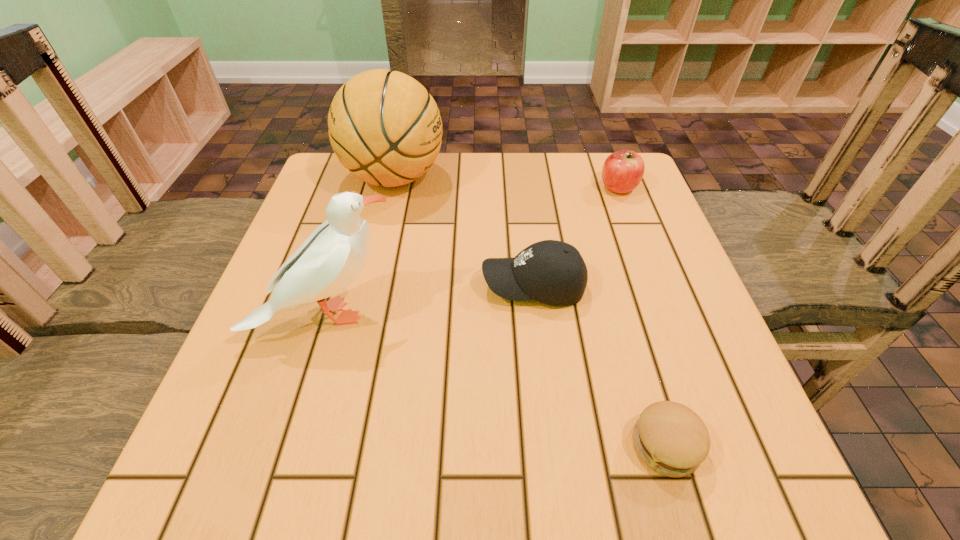
Identify the location of object at the far left corner. The width and height of the screenshot is (960, 540). (384, 126).

I want to click on object present at the far right corner, so click(x=623, y=170).

The height and width of the screenshot is (540, 960). I want to click on object situated at the near right corner, so click(x=670, y=438).

I want to click on vacant space at the far edge of the desktop, so click(408, 193).

Locate an element on the screen. This screenshot has width=960, height=540. vacant space at the near edge of the desktop is located at coordinates (645, 469).

In the image, there is a desktop. At what (x,y) coordinates should I click in order to perform the action: click on free space at the left edge. Please return your answer as a coordinate pair (x, y). The width and height of the screenshot is (960, 540). Looking at the image, I should click on (310, 308).

In the image, there is a desktop. Where is `free space at the right edge`? This screenshot has height=540, width=960. free space at the right edge is located at coordinates (722, 381).

In the image, there is a desktop. Identify the location of free space at the far left corner. (315, 179).

The height and width of the screenshot is (540, 960). In the image, there is a desktop. In order to click on vacant space at the near left corner in this screenshot , I will do `click(240, 438)`.

At what (x,y) coordinates should I click in order to perform the action: click on vacant region at the near right corner of the desktop. Please return your answer as a coordinate pair (x, y). This screenshot has width=960, height=540. Looking at the image, I should click on (729, 475).